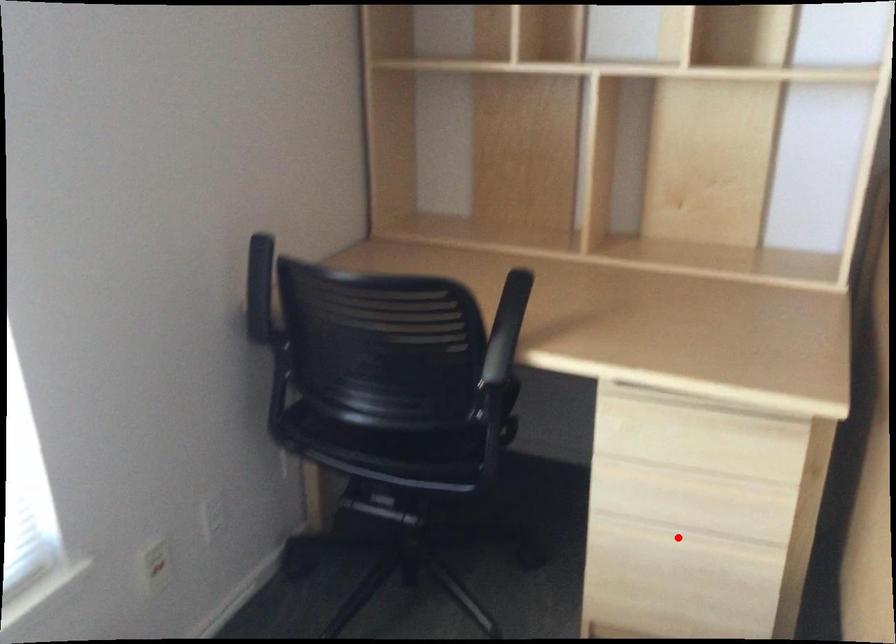
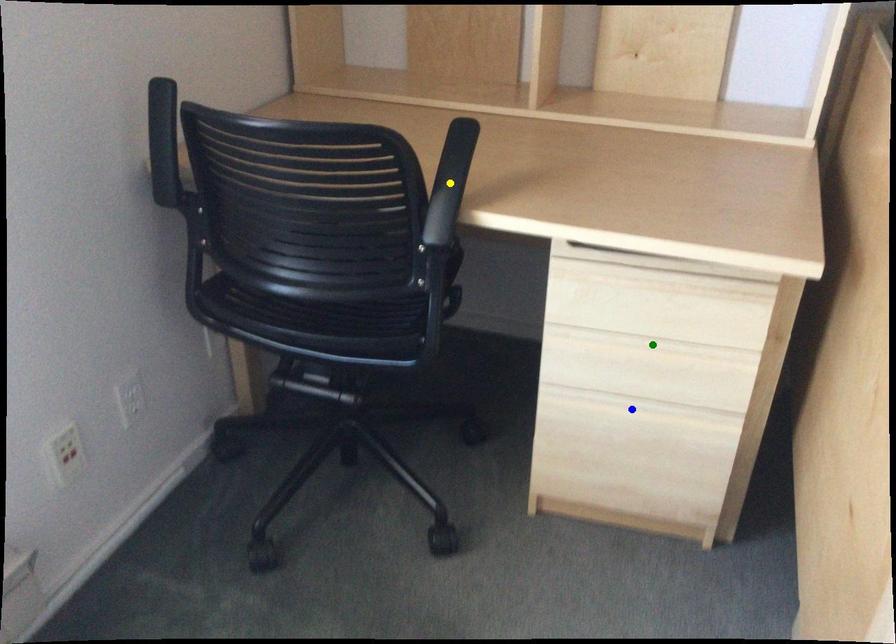
Question: I am providing you with two images of the same scene from different viewpoints. A red point is marked on the first image. You are given multiple points on the second image. Which mark in image 2 goes with the point in image 1?

Choices:
 (A) green point
 (B) yellow point
 (C) blue point

Answer: (C)